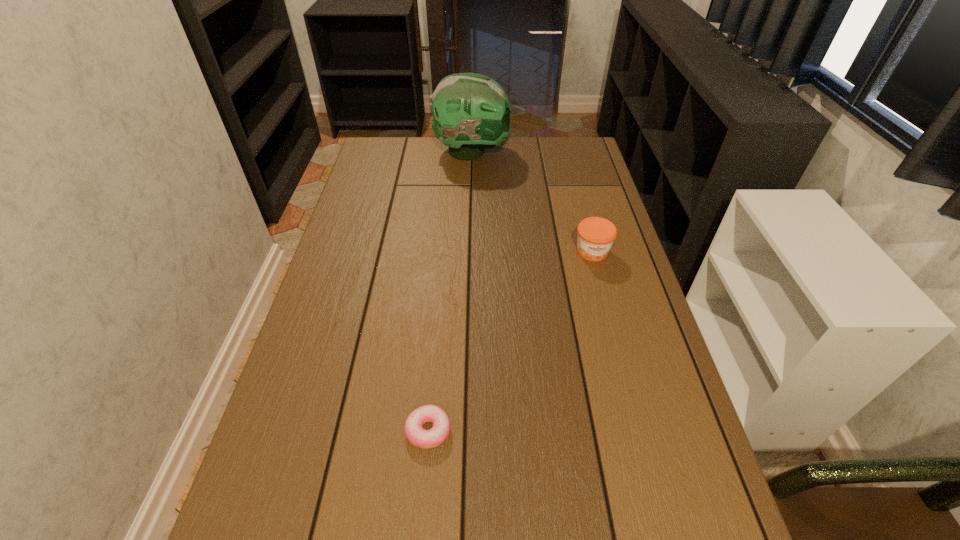
The height and width of the screenshot is (540, 960). I want to click on object at the right edge, so click(596, 235).

Locate an element on the screen. vacant area at the far edge of the desktop is located at coordinates (532, 157).

The height and width of the screenshot is (540, 960). Identify the location of vacant space at the left edge of the desktop. (251, 487).

Find the location of a particular element. vacant area at the right edge of the desktop is located at coordinates (593, 185).

The width and height of the screenshot is (960, 540). Find the location of `free point between the second tallest object and the shortest object`. free point between the second tallest object and the shortest object is located at coordinates pos(510,341).

Find the location of a particular element. The height and width of the screenshot is (540, 960). free space between the football helmet and the doughnut is located at coordinates (450, 291).

Where is `free space between the farthest object and the doughnut`? The height and width of the screenshot is (540, 960). free space between the farthest object and the doughnut is located at coordinates (450, 291).

Find the location of a particular element. vacant region between the tallest object and the second tallest object is located at coordinates (533, 202).

This screenshot has height=540, width=960. Identify the location of vacant area that lies between the tallest object and the nearest object. (450, 291).

Image resolution: width=960 pixels, height=540 pixels. In order to click on vacant space that is in between the tallest object and the second farthest object in this screenshot , I will do `click(533, 202)`.